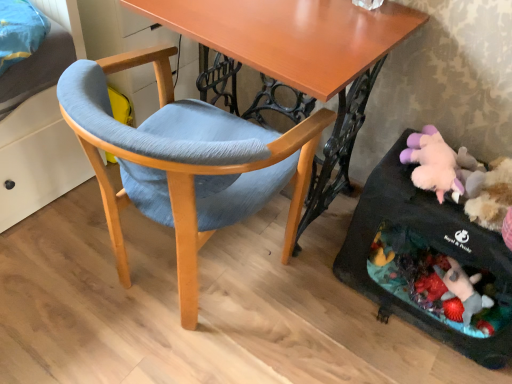
The width and height of the screenshot is (512, 384). I want to click on free location to the right of matte blue fabric chair at center, so click(x=329, y=319).